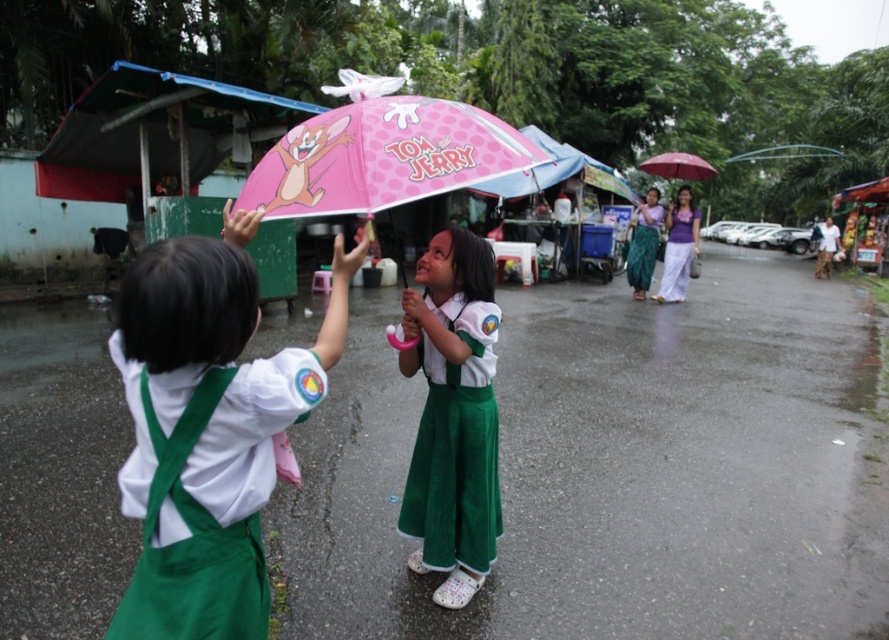
You are a photographer trying to capture the children in the rain. You notice the pink matte umbrella at center and the green textured dress at center. Which object should you focus on to ensure it fills more of your camera frame?

The pink matte umbrella at center is larger in size than the green textured dress at center, so focusing on the pink matte umbrella at center will fill more of the camera frame.

You are a photographer trying to capture the two children in the foreground. You notice the matte pink umbrella at center and the pink matte umbrella at center in your shot. Which umbrella should you focus on to ensure it appears larger in your photo?

The matte pink umbrella at center should be focused on because it is closer to the viewer than the pink matte umbrella at center, making it appear larger in the photo.

You are a photographer trying to capture the children in the scene. You notice the pink matte umbrella at center and the green textured dress at center. Which object should you focus on to ensure it appears larger in your photo?

The pink matte umbrella at center is closer to the viewer than the green textured dress at center, so focusing on it will make it appear larger in the photo.